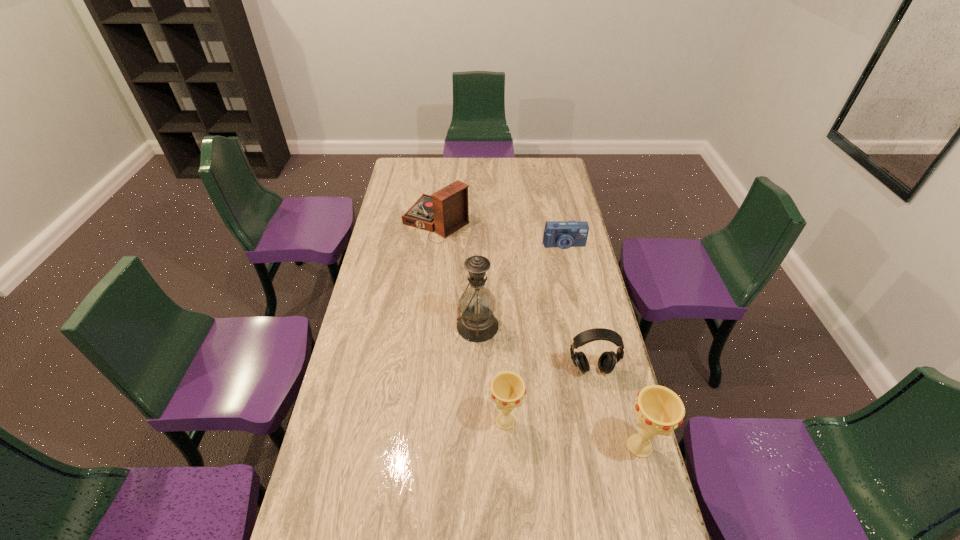
The width and height of the screenshot is (960, 540). Identify the location of the shorter chalice. (507, 389).

Where is `the taller chalice`? The height and width of the screenshot is (540, 960). the taller chalice is located at coordinates (658, 410).

The width and height of the screenshot is (960, 540). Find the location of `phonograph record`. phonograph record is located at coordinates (447, 210).

This screenshot has width=960, height=540. In order to click on the shortest object in this screenshot , I will do `click(564, 234)`.

Where is `earphone`? This screenshot has width=960, height=540. earphone is located at coordinates (607, 361).

This screenshot has height=540, width=960. I want to click on oil lamp, so click(x=477, y=323).

The image size is (960, 540). Find the location of `the fourth nearest object`. the fourth nearest object is located at coordinates (477, 323).

You are a GUI agent. You are given a task and a screenshot of the screen. Output one action in this format:
    pyautogui.click(x=<x>, y=<y>)
    Task: Click on the vacant space located 0.130m on the front of the left chalice
    Image resolution: width=960 pixels, height=540 pixels.
    Given the screenshot: What is the action you would take?
    pyautogui.click(x=508, y=483)

I want to click on free space located on the back of the taller chalice, so click(x=622, y=382).

The image size is (960, 540). Identify the location of vacant space situated on the front of the phonograph record. pos(428,292).